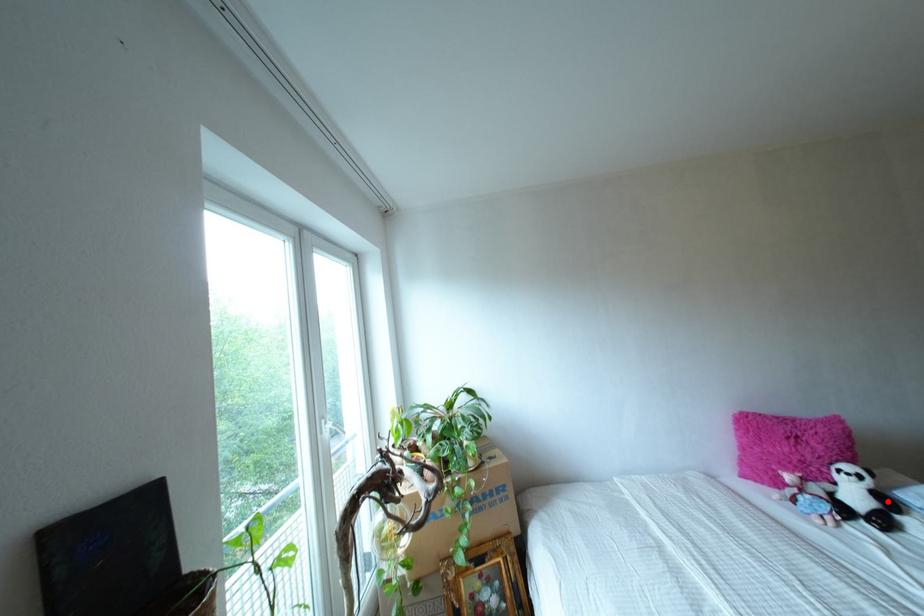
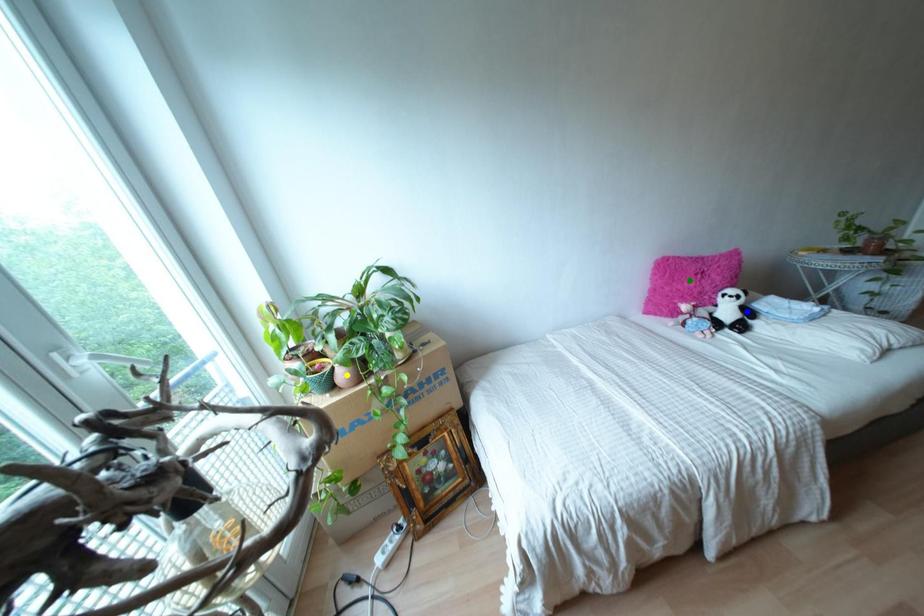
Question: I am providing you with two images of the same scene from different viewpoints. A red point is marked on the first image. You are given multiple points on the second image. Which spot in image 2 lines up with the point in image 1?

Choices:
 (A) blue point
 (B) yellow point
 (C) green point

Answer: (A)